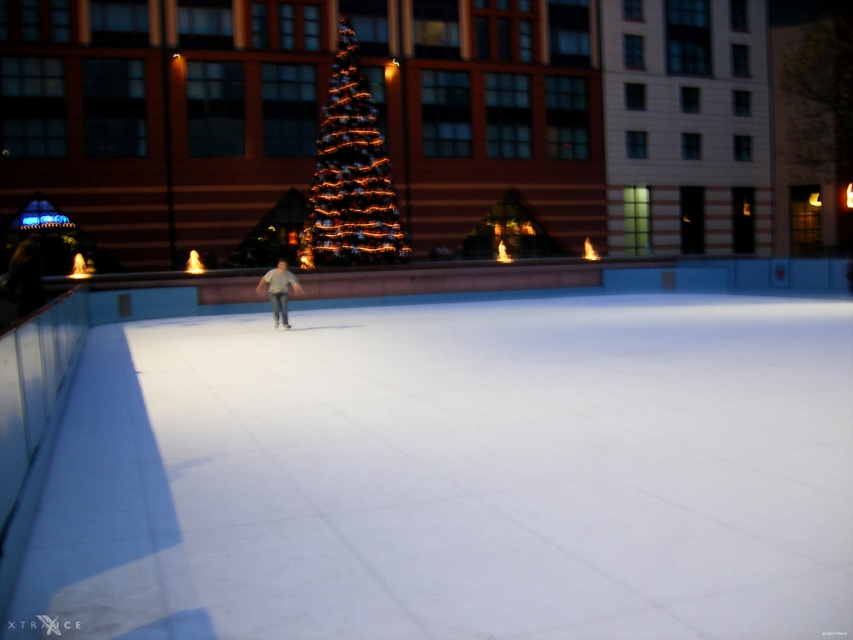
Is point (335, 140) closer to viewer compared to point (271, 298)?

No, (335, 140) is behind (271, 298).

Who is positioned more to the left, illuminated glass christmas tree at center or light gray cotton shirt at center?

light gray cotton shirt at center is more to the left.

This screenshot has width=853, height=640. Find the location of `illuminated glass christmas tree at center`. illuminated glass christmas tree at center is located at coordinates (350, 176).